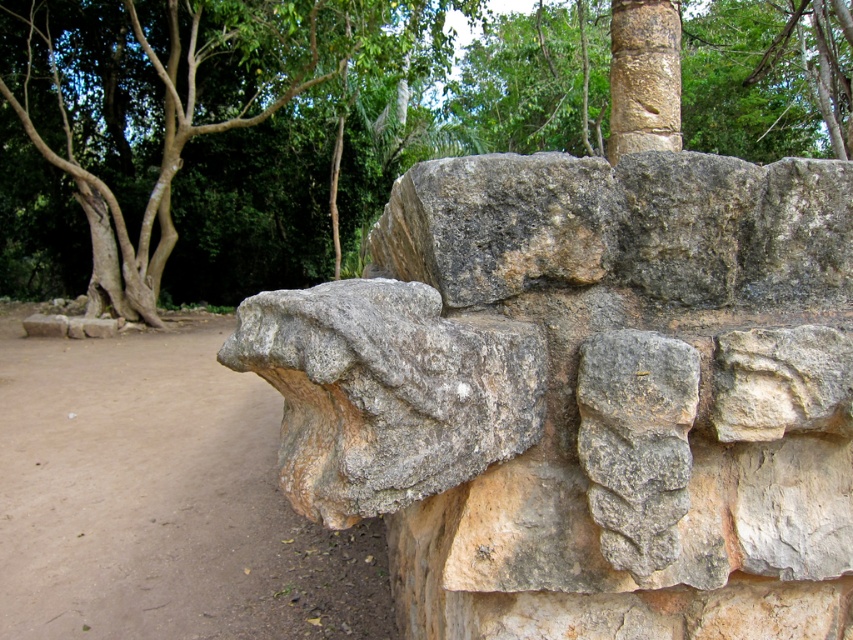
You are a hiker who wants to take a photo of the green leafy tree at upper center and the brown dirt field at lower left in the same frame. The camera you have can capture a maximum distance of 10 meters between objects. Will you be able to capture both in one shot?

The green leafy tree at upper center is 11.17 meters from the brown dirt field at lower left. Since the camera can only capture up to 10 meters between objects, the distance is too great to include both in one frame.

You are standing in front of the ancient stone wall and want to touch both points on the wall. Which point, point (772, 522) or point (209, 628), will you reach first?

Point (772, 522) is closer to the viewer than point (209, 628), so you will reach point (772, 522) first.

You are a construction worker needing to place a 2.5 meter long wooden beam horizontally between the gray stone wall at center and the smooth brown stone column at upper center. Can the beam fit between them?

The distance between the gray stone wall at center and the smooth brown stone column at upper center is 1.74 meters, so the 2.5 meter long wooden beam cannot fit horizontally between them as it is longer than the available space.